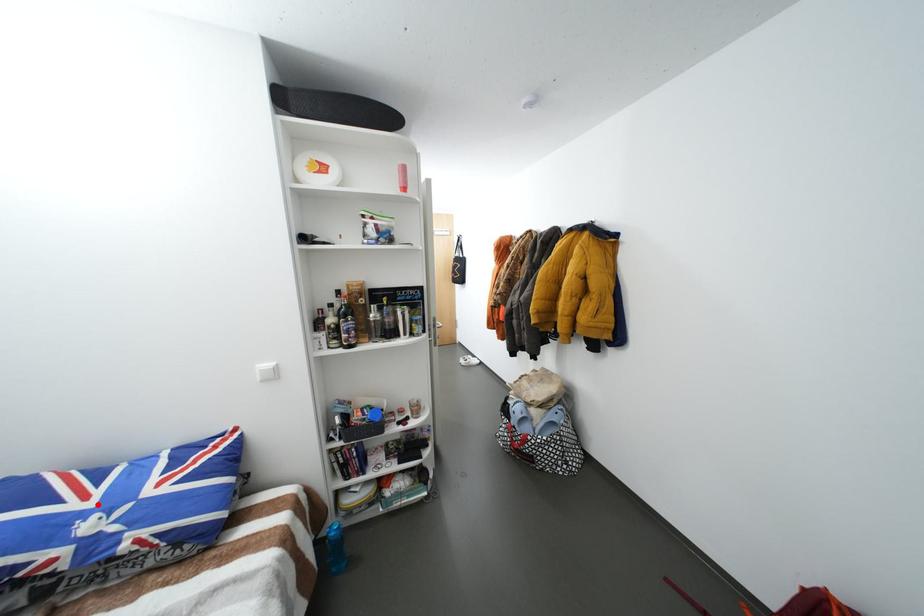
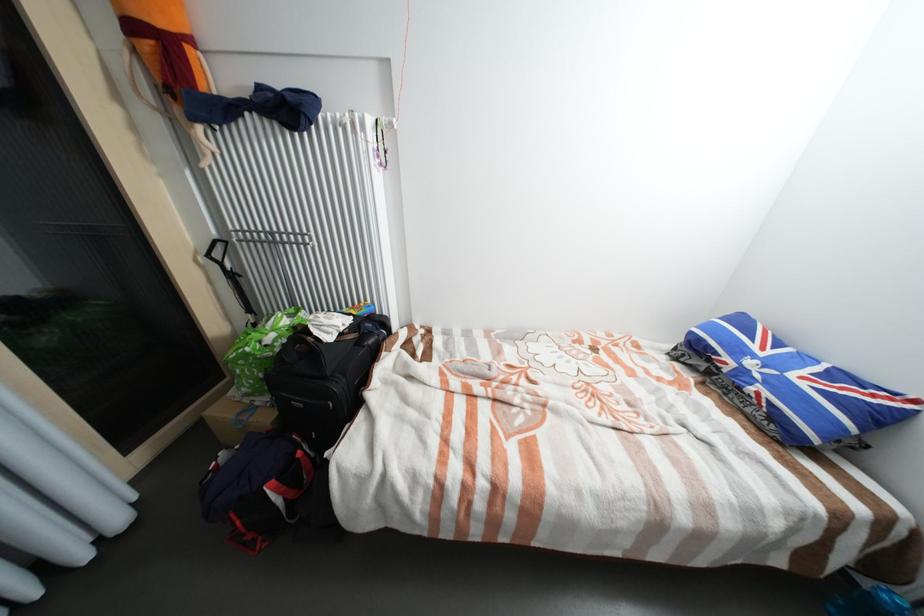
Where in the second image is the point corresponding to the highlighted location from the first image?

(769, 354)